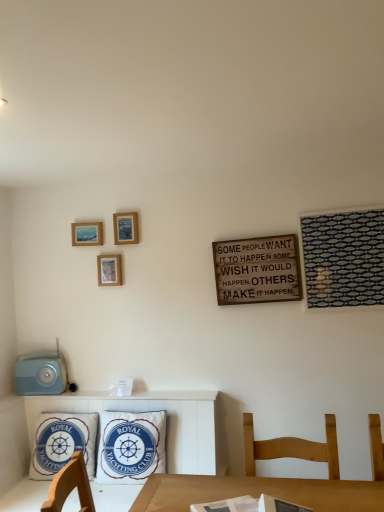
Question: In terms of size, does wooden chair at lower right appear bigger or smaller than wooden picture frame at upper left, which is counted as the second picture frame, starting from the top?

Choices:
 (A) small
 (B) big

Answer: (B)

Question: From the image's perspective, is wooden chair at lower right positioned above or below wooden picture frame at upper left, marked as the 1th picture frame in a left-to-right arrangement?

Choices:
 (A) below
 (B) above

Answer: (A)

Question: Which object is positioned closest to the white fabric pillow at center, which ranks as the 2th pillow in left-to-right order?

Choices:
 (A) wooden picture frame at upper center, the third picture frame positioned from the left
 (B) wooden signboard at center-right
 (C) blue cotton pillow at lower left, which is the second pillow from right to left
 (D) wooden picture frame at center-left, the 3th picture frame when ordered from top to bottom
 (E) wooden chair at lower right

Answer: (C)

Question: Considering the real-world distances, which object is closest to the wooden picture frame at upper center, which appears as the first picture frame when viewed from the right?

Choices:
 (A) white fabric pillow at center, the 1th pillow in the right-to-left sequence
 (B) blue cotton pillow at lower left, acting as the first pillow starting from the left
 (C) wooden signboard at center-right
 (D) wooden picture frame at upper left, marked as the 1th picture frame in a left-to-right arrangement
 (E) wooden chair at lower right

Answer: (D)